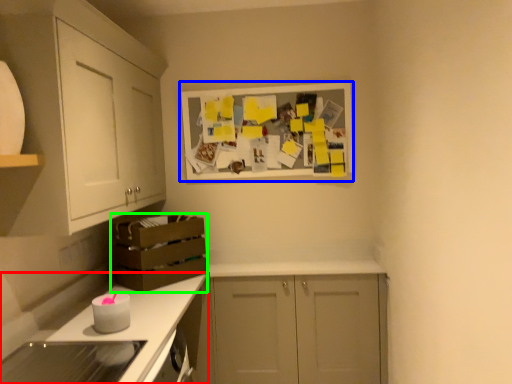
Question: Considering the real-world distances, which object is closest to countertop (highlighted by a red box)? picture frame (highlighted by a blue box) or crate (highlighted by a green box).

Choices:
 (A) picture frame
 (B) crate

Answer: (B)